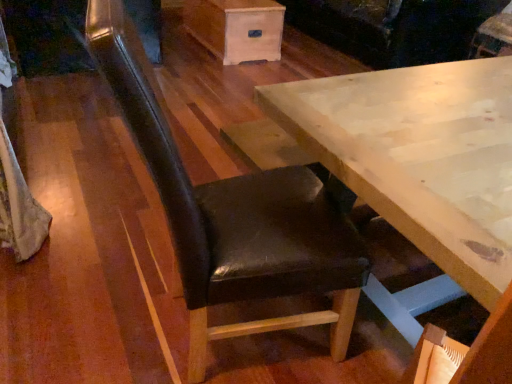
What are the coordinates of `vacant space that is to the left of black leather chair at center` in the screenshot? It's located at (85, 300).